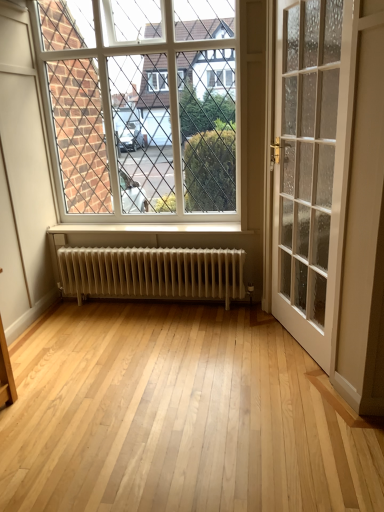
The width and height of the screenshot is (384, 512). I want to click on blank space to the left of white glass door at right, so click(x=238, y=347).